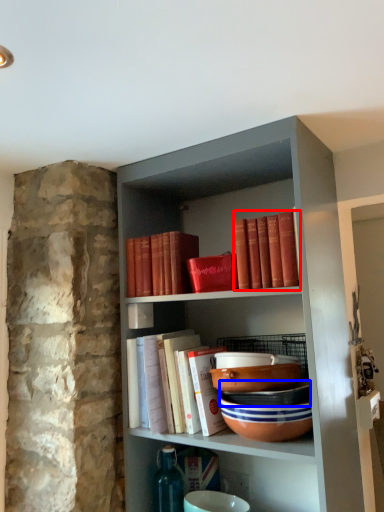
Question: Which of the following is the farthest to the observer, book (highlighted by a red box) or bowl (highlighted by a blue box)?

Choices:
 (A) book
 (B) bowl

Answer: (B)